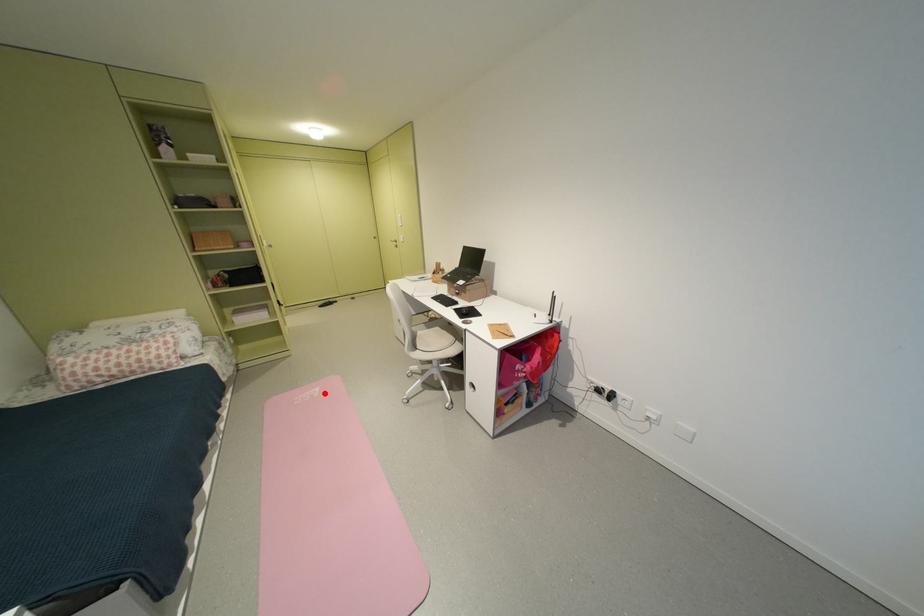
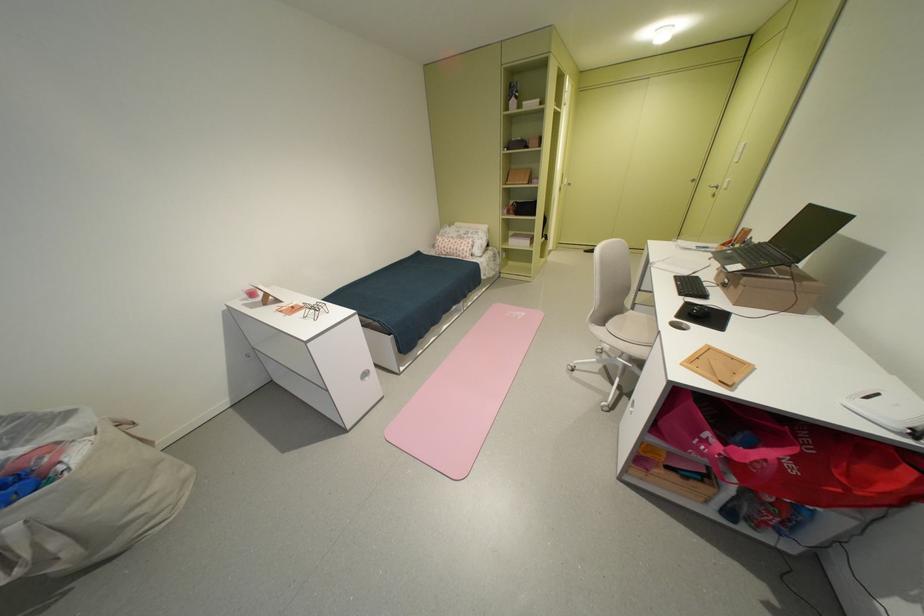
In the second image, find the point that corresponds to the highlighted location in the first image.

(530, 315)